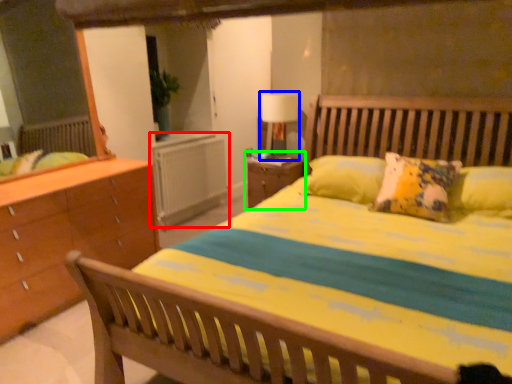
Question: Considering the real-world distances, which object is closest to radiator (highlighted by a red box)? table lamp (highlighted by a blue box) or nightstand (highlighted by a green box).

Choices:
 (A) table lamp
 (B) nightstand

Answer: (B)